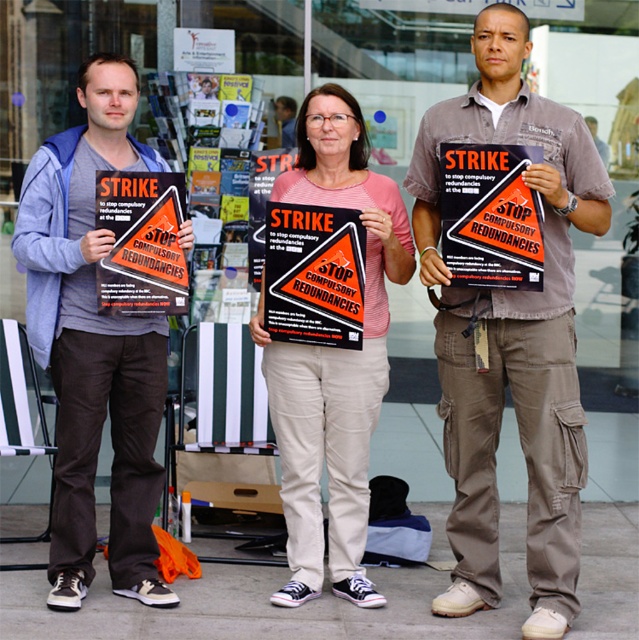
Between khaki cargo pants at center and matte gray t-shirt at left, which one appears on the right side from the viewer's perspective?

Positioned to the right is khaki cargo pants at center.

Can you confirm if khaki cargo pants at center is positioned to the right of matte gray t-shirt at left?

Correct, you'll find khaki cargo pants at center to the right of matte gray t-shirt at left.

Does point (516, 348) come farther from viewer compared to point (70, 307)?

Yes, it is behind point (70, 307).

What are the coordinates of `khaki cargo pants at center` in the screenshot? It's located at (512, 336).

Who is positioned more to the right, matte pink shirt at center or orange paper poster at center?

matte pink shirt at center

Can you confirm if matte pink shirt at center is smaller than orange paper poster at center?

Incorrect, matte pink shirt at center is not smaller in size than orange paper poster at center.

Who is more distant from viewer, (343, 486) or (298, 280)?

The point (343, 486) is more distant.

The image size is (639, 640). I want to click on matte pink shirt at center, so tap(334, 358).

Does matte gray t-shirt at left have a smaller size compared to matte black poster at center?

No, matte gray t-shirt at left is not smaller than matte black poster at center.

Does matte gray t-shirt at left appear under matte black poster at center?

Indeed, matte gray t-shirt at left is positioned under matte black poster at center.

Which is behind, point (134, 323) or point (96, 170)?

The point (134, 323) is behind.

In order to click on matte gray t-shirt at left in this screenshot , I will do `click(93, 346)`.